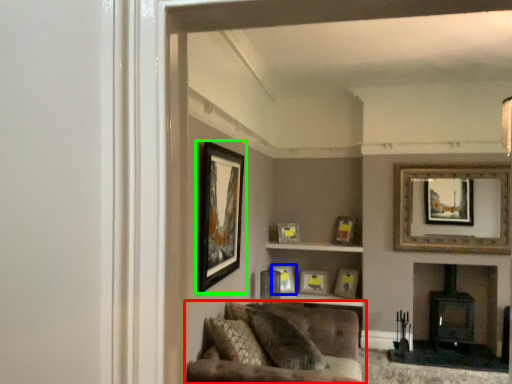
Question: Which is farther away from studio couch (highlighted by a red box)? picture frame (highlighted by a blue box) or picture frame (highlighted by a green box)?

Choices:
 (A) picture frame
 (B) picture frame

Answer: (A)